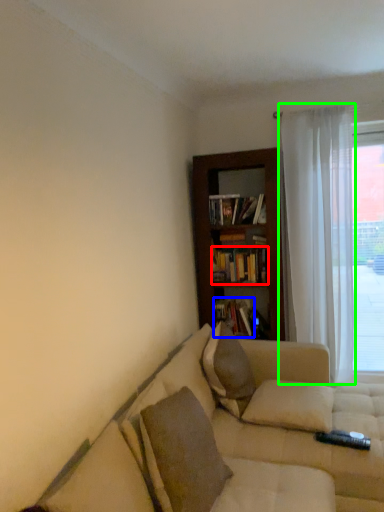
Question: Which is farther away from book (highlighted by a red box)? book (highlighted by a blue box) or curtain (highlighted by a green box)?

Choices:
 (A) book
 (B) curtain

Answer: (B)